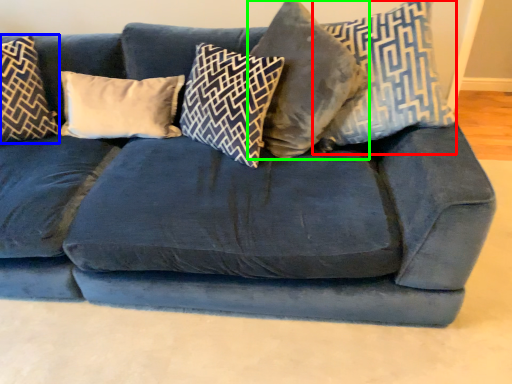
Question: Considering the real-world distances, which object is farthest from pillow (highlighted by a red box)? pillow (highlighted by a blue box) or pillow (highlighted by a green box)?

Choices:
 (A) pillow
 (B) pillow

Answer: (A)